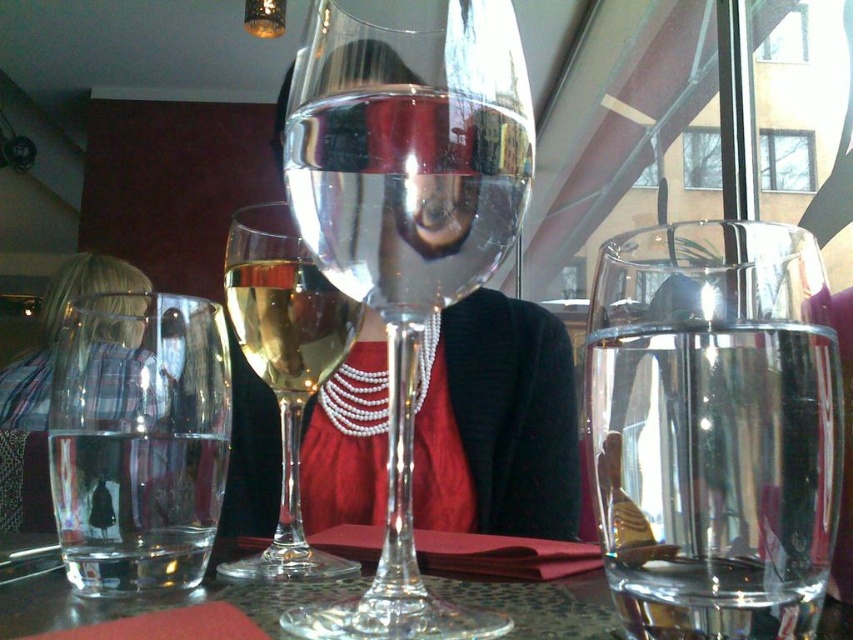
Question: Among these points, which one is farthest from the camera?

Choices:
 (A) (294, 464)
 (B) (282, 589)
 (C) (428, 154)

Answer: (A)

Question: Observing the image, what is the correct spatial positioning of transparent glass wine glass at center in reference to translucent glass wine glass at center?

Choices:
 (A) left
 (B) right

Answer: (B)

Question: Which point appears closest to the camera in this image?

Choices:
 (A) (67, 612)
 (B) (273, 268)
 (C) (457, 99)

Answer: (C)

Question: Which of the following is the closest to the observer?

Choices:
 (A) translucent glass wine glass at center
 (B) clear glass water at center
 (C) clear glass wine at center
 (D) transparent glass wine glass at center

Answer: (D)

Question: Is clear glass wine at center to the right of translucent glass wine glass at center from the viewer's perspective?

Choices:
 (A) yes
 (B) no

Answer: (A)

Question: Does transparent glass wine glass at center appear under clear glass wine at center?

Choices:
 (A) no
 (B) yes

Answer: (B)